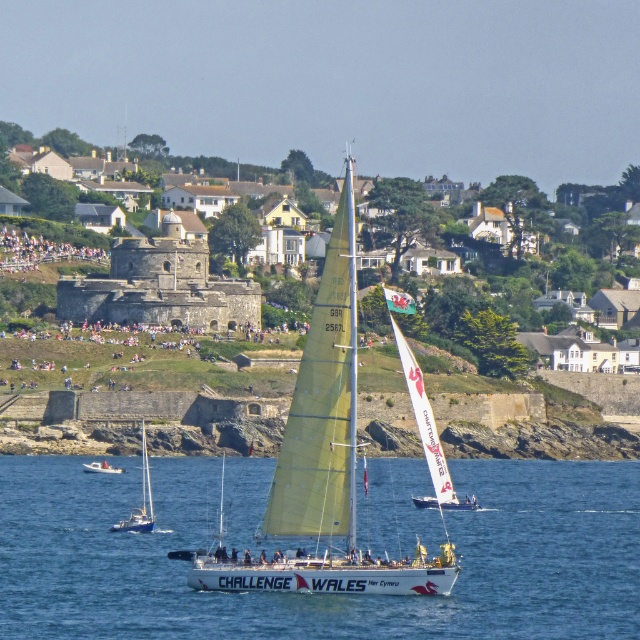
What do you see at coordinates (141, 500) in the screenshot? I see `white sailboat at lower left` at bounding box center [141, 500].

Who is more distant from viewer, (145, 465) or (92, 468)?

The point (145, 465) is behind.

Identify the location of white sailboat at lower left. This screenshot has height=640, width=640. (141, 500).

Identify the location of white sailboat at lower left. The image size is (640, 640). pyautogui.click(x=141, y=500).

Can you confirm if white water at center is smaller than white plastic boat at lower left?

Incorrect, white water at center is not smaller in size than white plastic boat at lower left.

Who is more distant from viewer, [129,541] or [92,465]?

The point [92,465] is behind.

You are a GUI agent. You are given a task and a screenshot of the screen. Output one action in this format:
    pyautogui.click(x=<x>, y=<y>)
    Task: Click on the white water at center
    
    Given the screenshot: What is the action you would take?
    pyautogui.click(x=317, y=595)

Does white water at center have a greater width compared to white matte sailboat at center?

Correct, the width of white water at center exceeds that of white matte sailboat at center.

Is the position of white water at center less distant than that of white matte sailboat at center?

Yes, it is.

Does point (604, 509) come in front of point (428, 563)?

No, (604, 509) is further to viewer.

Locate an element on the screen. white water at center is located at coordinates click(x=317, y=595).